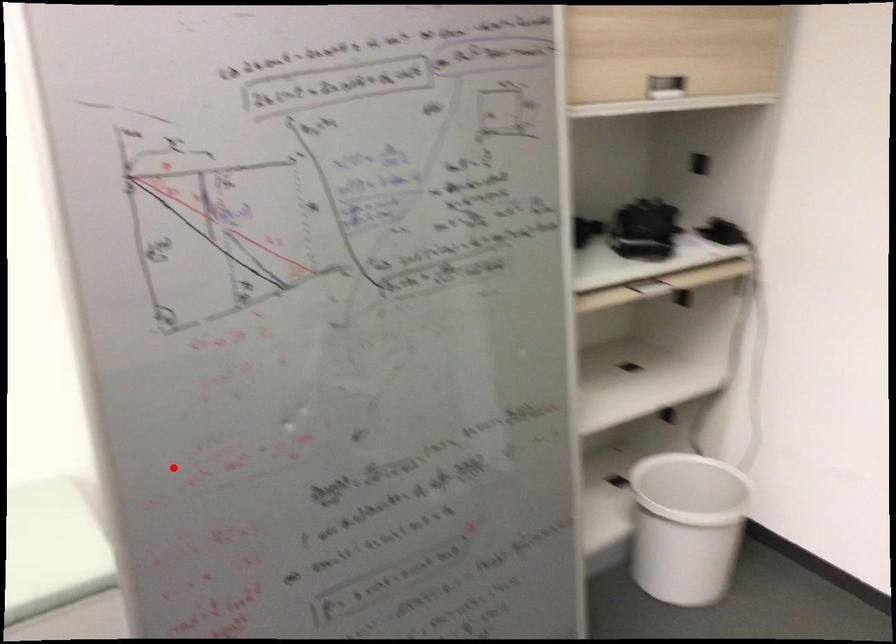
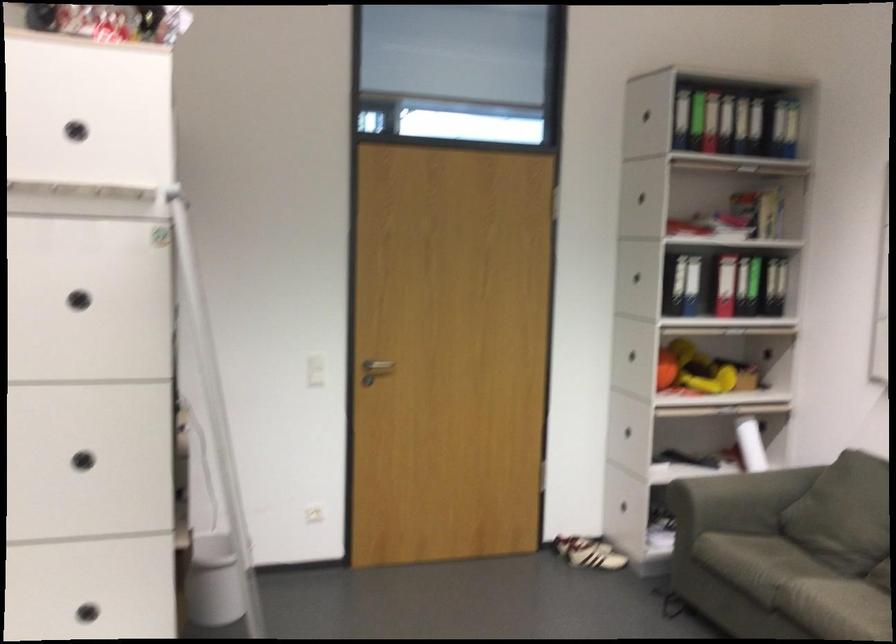
Question: I am providing you with two images of the same scene from different viewpoints. Image1 has a red point marked. In image2, the corresponding 3D location appears at what relative position? Reply with the corresponding letter.

Choices:
 (A) Closer
 (B) Farther

Answer: (B)